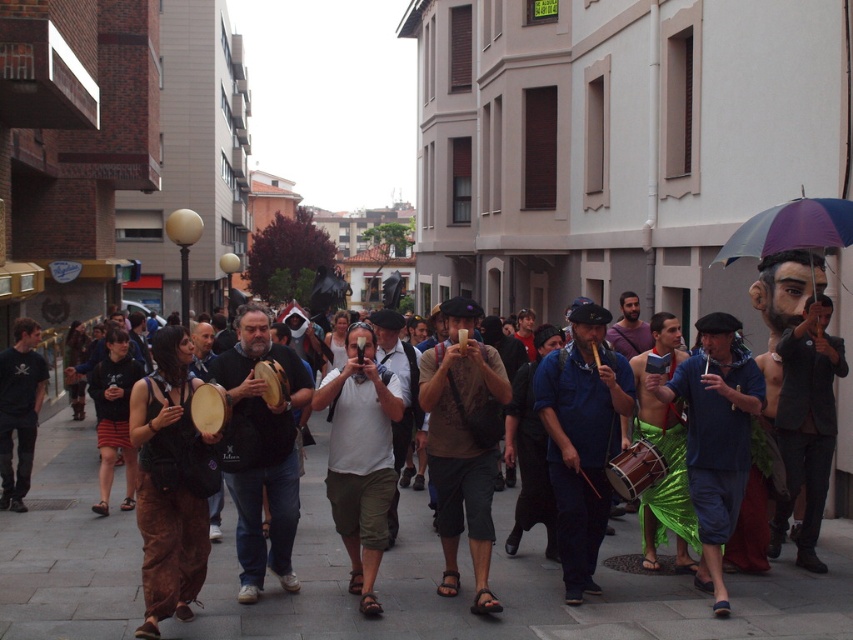
You are a photographer trying to capture a photo of both the shiny green skirt at center and the blue fabric pants at center during the parade. Which one should you focus on first if you want to include both in your shot without moving the camera?

You should focus on the blue fabric pants at center first because the shiny green skirt at center is to the right of it, so by centering the blue fabric pants at center, you can frame both objects within the same shot without needing to reposition the camera.

Based on the photo, you are standing at the starting point of the street and want to reach the end. There are two points marked on the map of the street. The first point is at coordinate point (734, 442) and the second is at point (553, 536). Which point would you encounter first while moving from the start to the end of the street?

Since point (734, 442) is in front of point (553, 536), you would encounter point (734, 442) first while moving from the start to the end of the street.

You are a street performer with a 1.5 meter long pole. You need to move from the shiny green skirt at center to the purple fabric umbrella at upper right. Can your pole fit horizontally between them without tilting?

The distance between the shiny green skirt at center and the purple fabric umbrella at upper right is 1.61 meters. Since your pole is 1.5 meters long, it can fit horizontally between them without tilting as the space is wider than the pole.